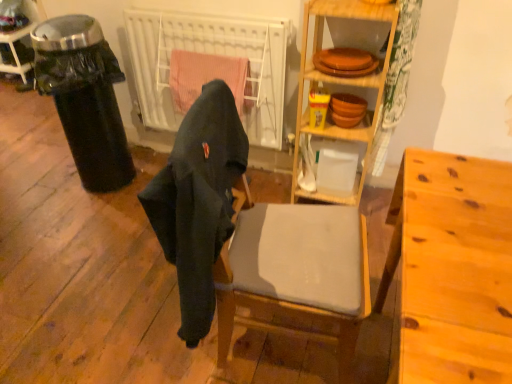
You are a GUI agent. You are given a task and a screenshot of the screen. Output one action in this format:
    pyautogui.click(x=<x>, y=<y>)
    Task: Click on the free space to the left of matte gray cushioned chair at center
    The width and height of the screenshot is (512, 384).
    Given the screenshot: What is the action you would take?
    pyautogui.click(x=147, y=325)